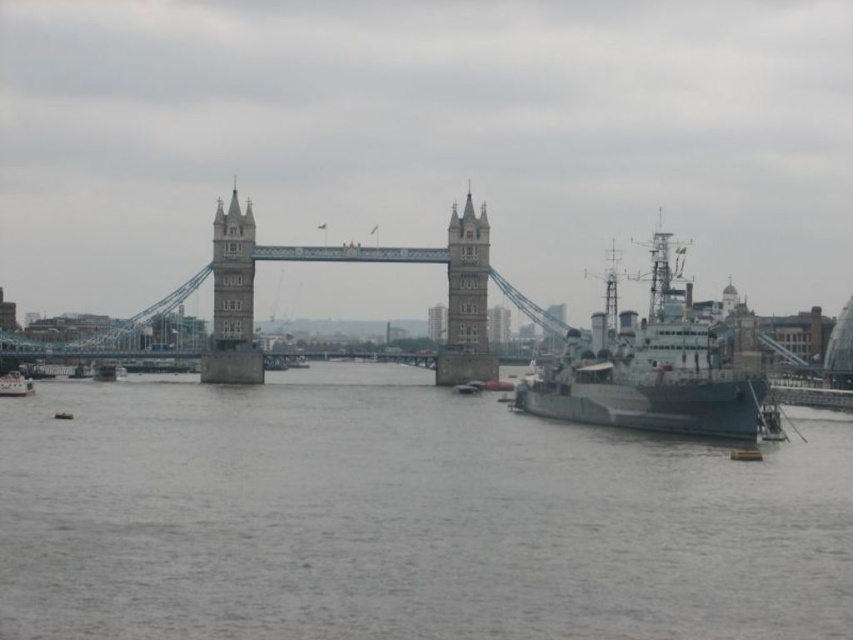
Which is more to the right, dark gray metallic ship at right or stone tower at center?

dark gray metallic ship at right

Between dark gray metallic ship at right and stone tower at center, which one has more height?

Standing taller between the two is stone tower at center.

What do you see at coordinates (647, 371) in the screenshot? I see `dark gray metallic ship at right` at bounding box center [647, 371].

Locate an element on the screen. Image resolution: width=853 pixels, height=640 pixels. dark gray metallic ship at right is located at coordinates pyautogui.click(x=647, y=371).

Identify the location of gray water at center. The height and width of the screenshot is (640, 853). (403, 516).

Does gray water at center have a lesser width compared to stone tower at center?

Incorrect, gray water at center's width is not less than stone tower at center's.

What do you see at coordinates (403, 516) in the screenshot? This screenshot has width=853, height=640. I see `gray water at center` at bounding box center [403, 516].

Where is `gray water at center`? The width and height of the screenshot is (853, 640). gray water at center is located at coordinates (403, 516).

Is point (212, 381) positioned after point (12, 385)?

No, (212, 381) is in front of (12, 385).

Does point (218, 292) lie behind point (0, 384)?

No.

Identify the location of stone tower at center. (231, 300).